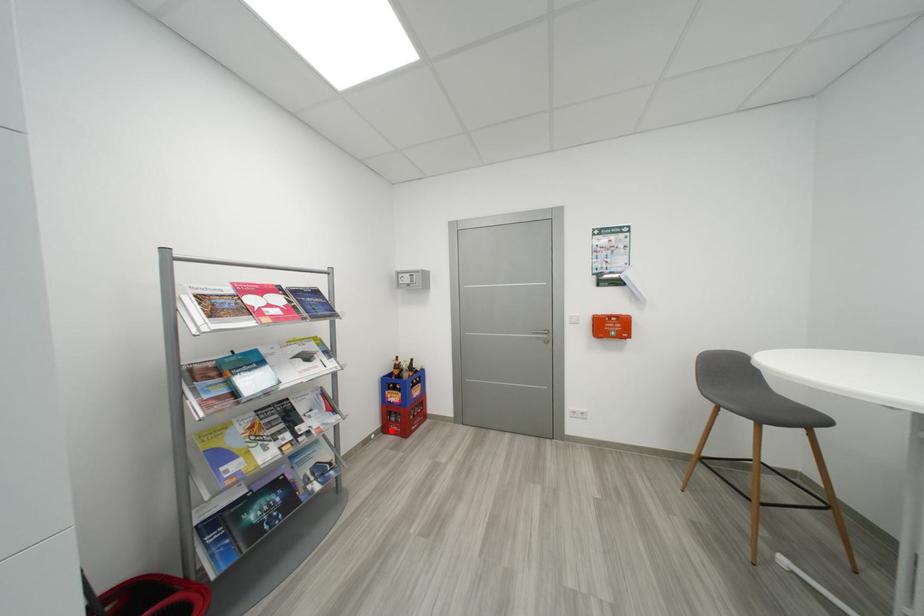
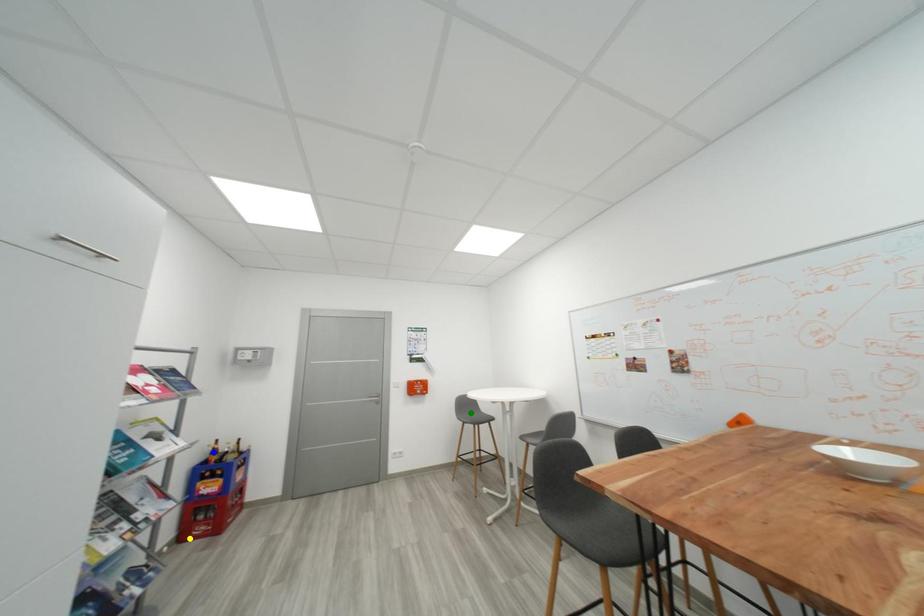
Question: I am providing you with two images of the same scene from different viewpoints. A red point is marked on the first image. You are given multiple points on the second image. Can you choose the point in image 2 that corresponds to the point in image 1?

Choices:
 (A) yellow point
 (B) green point
 (C) blue point

Answer: (A)